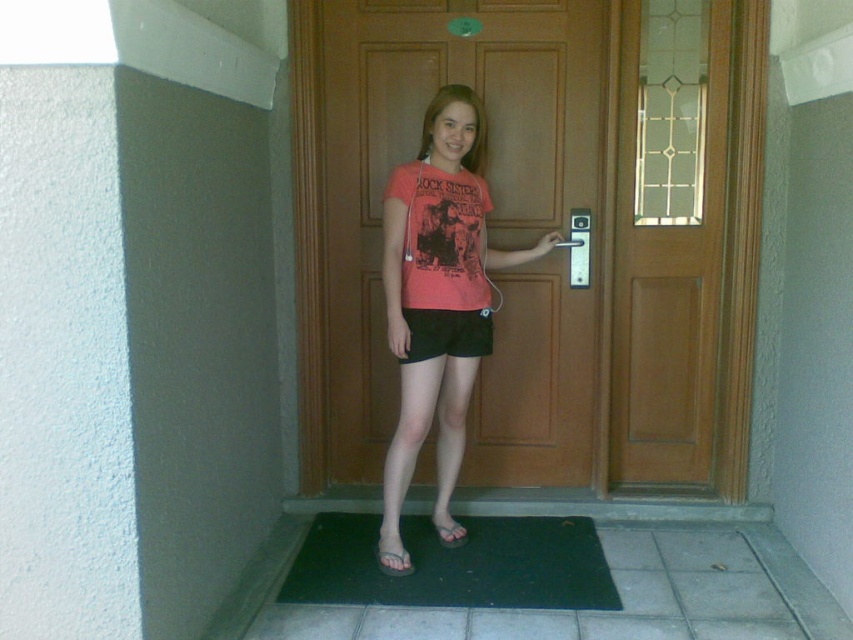
Question: Is black rubber mat at lower center smaller than black matte shorts at center?

Choices:
 (A) no
 (B) yes

Answer: (A)

Question: Can you confirm if black rubber mat at lower center is thinner than black matte shorts at center?

Choices:
 (A) no
 (B) yes

Answer: (A)

Question: Can you confirm if black rubber mat at lower center is bigger than black matte shorts at center?

Choices:
 (A) no
 (B) yes

Answer: (B)

Question: Based on their relative distances, which object is nearer to the black matte shorts at center?

Choices:
 (A) black rubber mat at lower center
 (B) brown wooden door at center

Answer: (B)

Question: Which object is farther from the camera taking this photo?

Choices:
 (A) pink matte t-shirt at center
 (B) black rubber mat at lower center

Answer: (A)

Question: Among these objects, which one is nearest to the camera?

Choices:
 (A) pink matte t-shirt at center
 (B) black rubber mat at lower center
 (C) black matte shorts at center

Answer: (B)